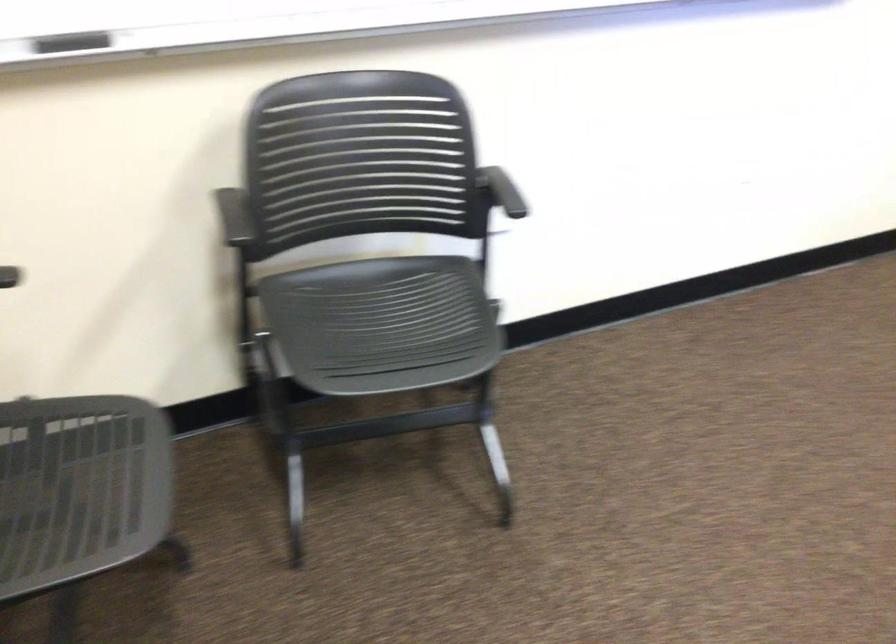
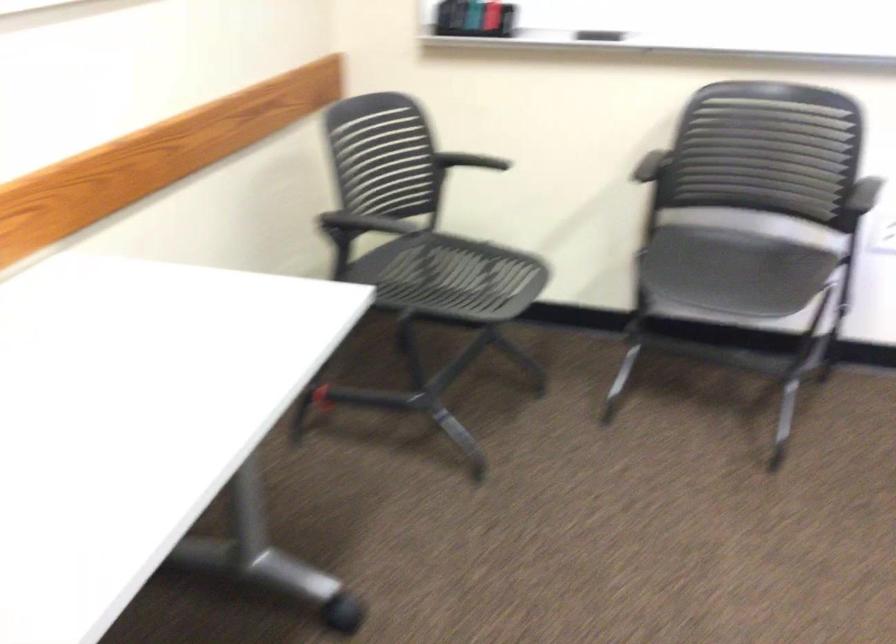
Locate, in the second image, the point that corresponds to point 510,196 in the first image.

(865, 194)